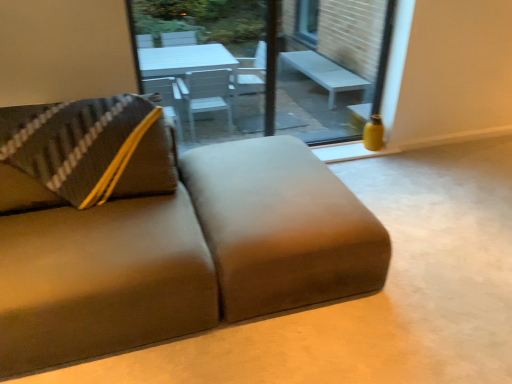
Locate an element on the screen. The height and width of the screenshot is (384, 512). vacant space in front of suede-like beige footrest at lower center is located at coordinates (306, 347).